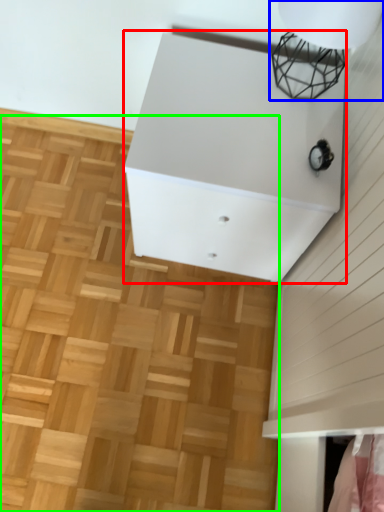
Question: Estimate the real-world distances between objects in this image. Which object is closer to furniture (highlighted by a red box), lamp (highlighted by a blue box) or hardwood (highlighted by a green box)?

Choices:
 (A) lamp
 (B) hardwood

Answer: (A)